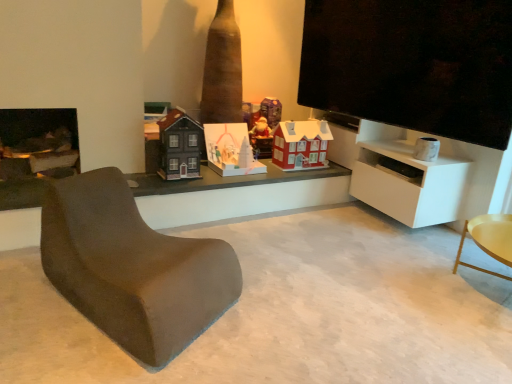
Question: Is white matte cabinet at right outside matte red house at center, placed as the third toy when sorted from left to right?

Choices:
 (A) no
 (B) yes

Answer: (B)

Question: Is white matte cabinet at right to the right of matte red house at center, placed as the third toy when sorted from left to right, from the viewer's perspective?

Choices:
 (A) yes
 (B) no

Answer: (A)

Question: Considering the relative sizes of white matte cabinet at right and matte red house at center, the 2th toy in the right-to-left sequence, in the image provided, is white matte cabinet at right shorter than matte red house at center, the 2th toy in the right-to-left sequence,?

Choices:
 (A) no
 (B) yes

Answer: (A)

Question: Does white matte cabinet at right come in front of matte red house at center, the 2th toy in the right-to-left sequence?

Choices:
 (A) no
 (B) yes

Answer: (B)

Question: From the image's perspective, is white matte cabinet at right beneath matte red house at center, the 2th toy in the right-to-left sequence?

Choices:
 (A) no
 (B) yes

Answer: (B)

Question: Is white matte cabinet at right positioned far away from matte red house at center, placed as the third toy when sorted from left to right?

Choices:
 (A) no
 (B) yes

Answer: (A)

Question: From a real-world perspective, is matte red house at center, the first toy positioned from the right, on top of matte brown chair at lower left?

Choices:
 (A) yes
 (B) no

Answer: (A)

Question: Is matte red house at center, acting as the 4th toy starting from the left, at the left side of matte brown chair at lower left?

Choices:
 (A) no
 (B) yes

Answer: (A)

Question: Is matte brown chair at lower left at the back of matte red house at center, the first toy positioned from the right?

Choices:
 (A) no
 (B) yes

Answer: (A)

Question: Does matte red house at center, acting as the 4th toy starting from the left, have a greater height compared to matte brown chair at lower left?

Choices:
 (A) yes
 (B) no

Answer: (B)

Question: Are matte red house at center, acting as the 4th toy starting from the left, and matte brown chair at lower left located far from each other?

Choices:
 (A) yes
 (B) no

Answer: (A)

Question: Is matte red house at center, the first toy positioned from the right, shorter than matte brown chair at lower left?

Choices:
 (A) yes
 (B) no

Answer: (A)

Question: Is matte white paper house at center, acting as the 3th toy starting from the right, in front of matte red house at center, placed as the third toy when sorted from left to right?

Choices:
 (A) yes
 (B) no

Answer: (A)